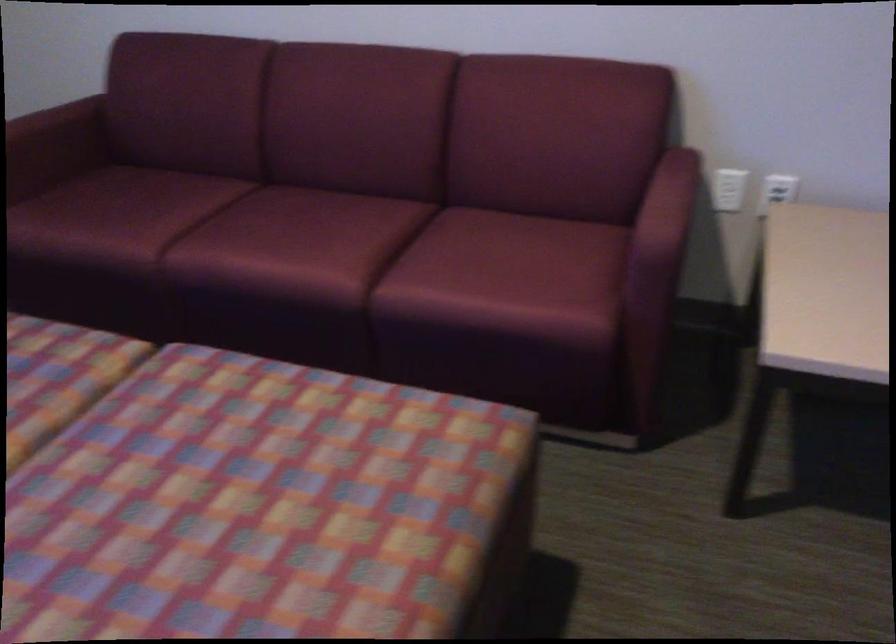
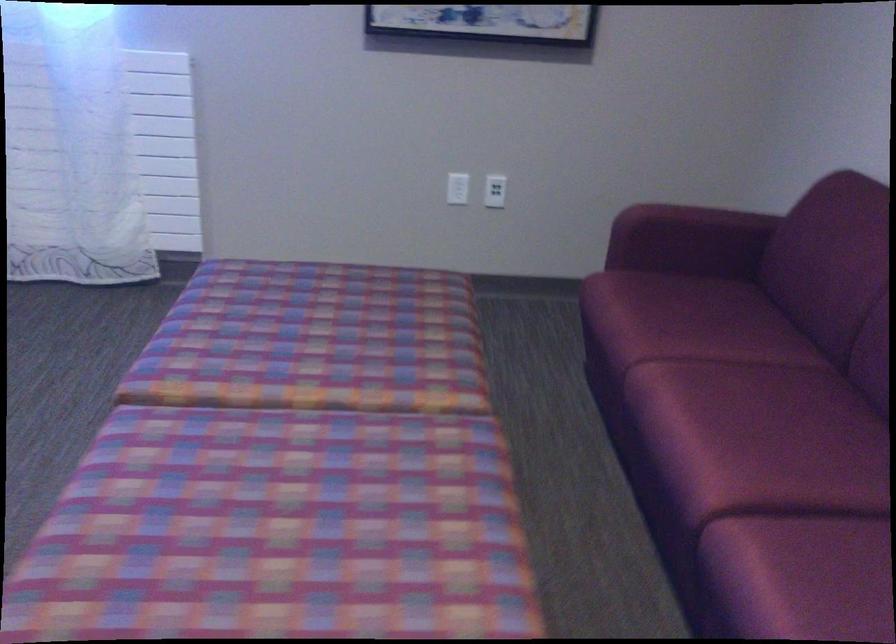
Find the pixel in the second image that matches point (174, 102) in the first image.

(822, 256)